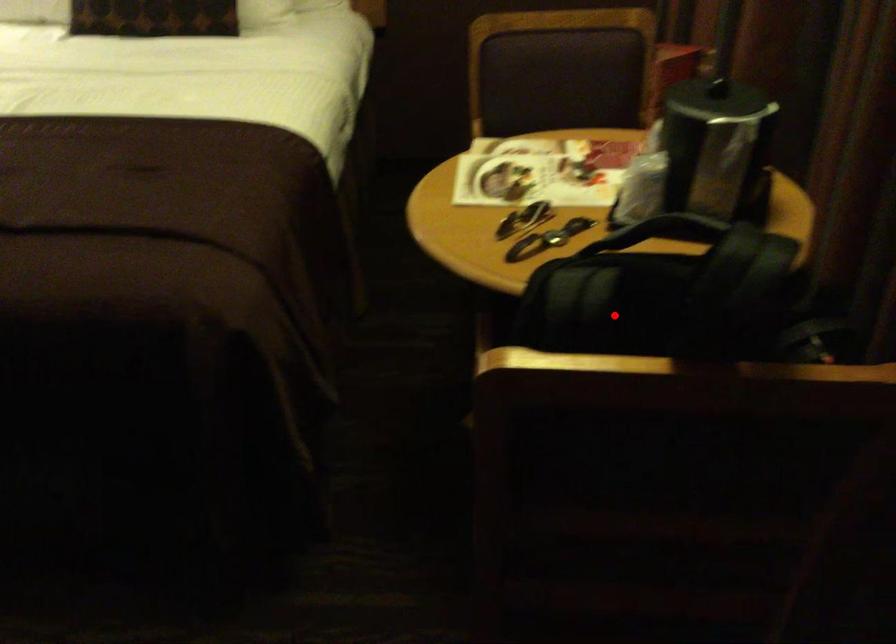
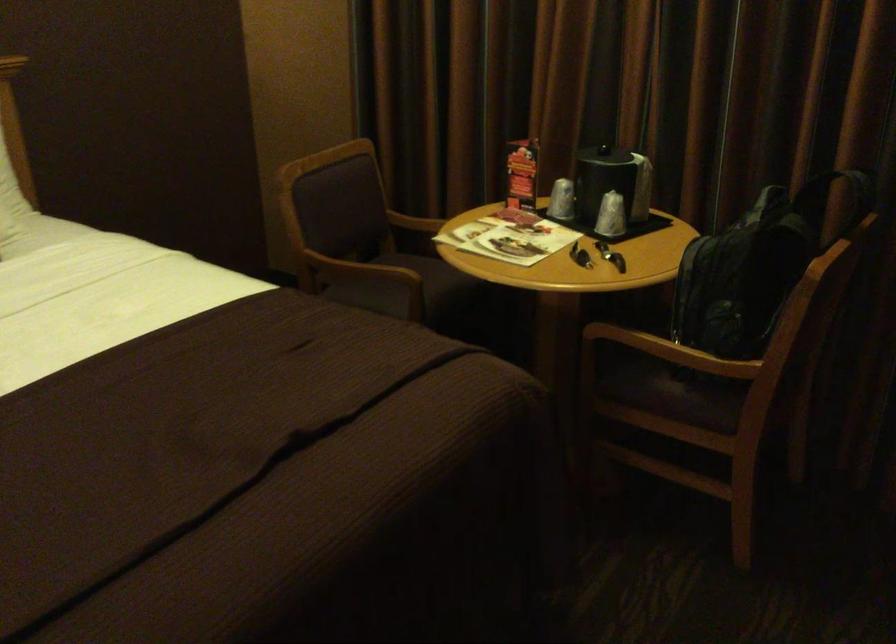
Question: A red point is marked in image1. In image2, is the corresponding 3D point closer to the camera or farther? Reply with the corresponding letter.

Choices:
 (A) The corresponding 3D point is closer.
 (B) The corresponding 3D point is farther.

Answer: (B)